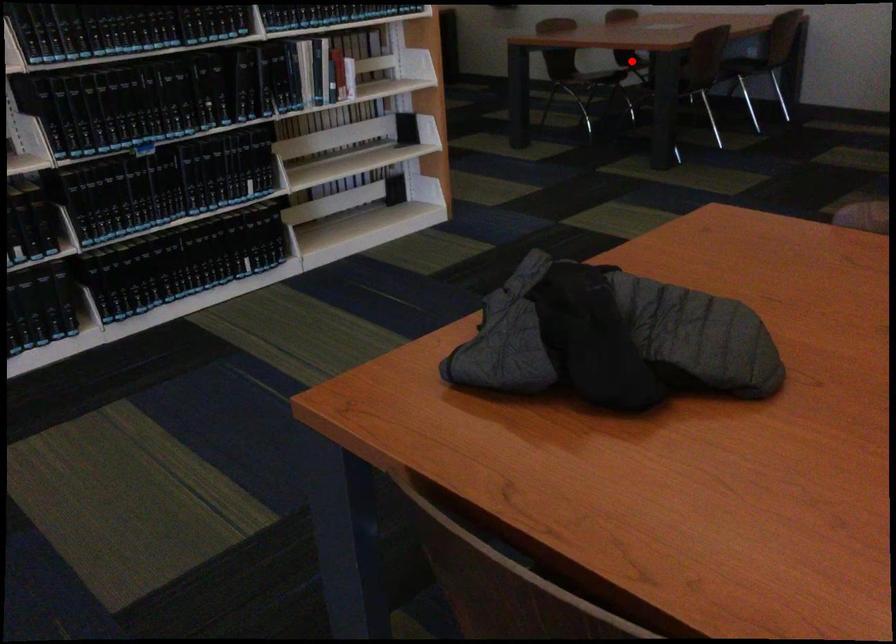
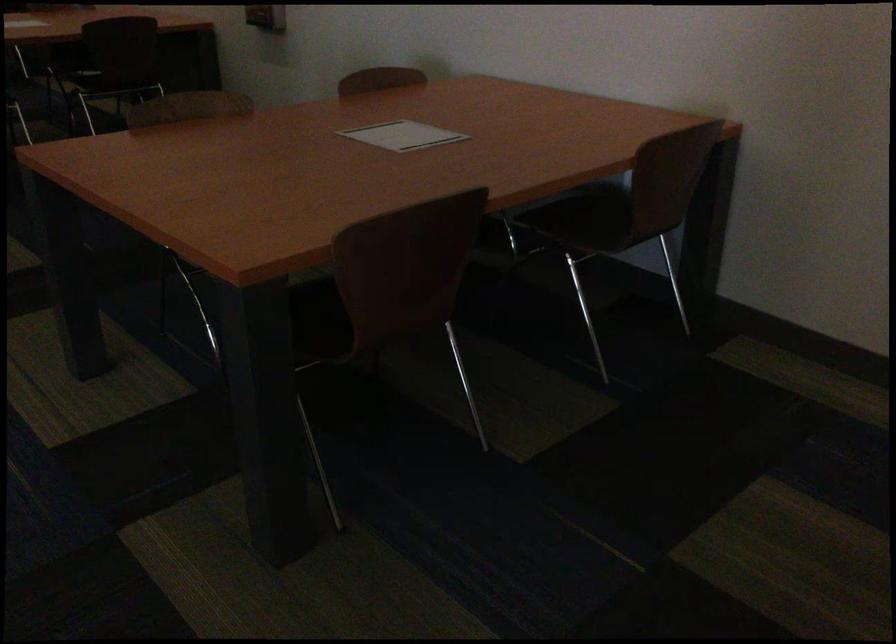
Question: I am providing you with two images of the same scene from different viewpoints. A red point is marked on the first image. Is the red point's position out of view in image 2?

Choices:
 (A) Yes
 (B) No

Answer: (A)